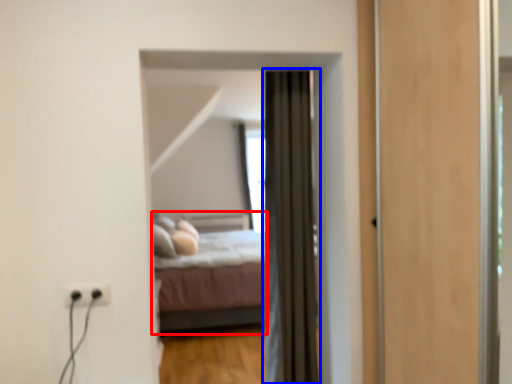
Question: Among these objects, which one is nearest to the camera, bed (highlighted by a red box) or curtain (highlighted by a blue box)?

Choices:
 (A) bed
 (B) curtain

Answer: (B)